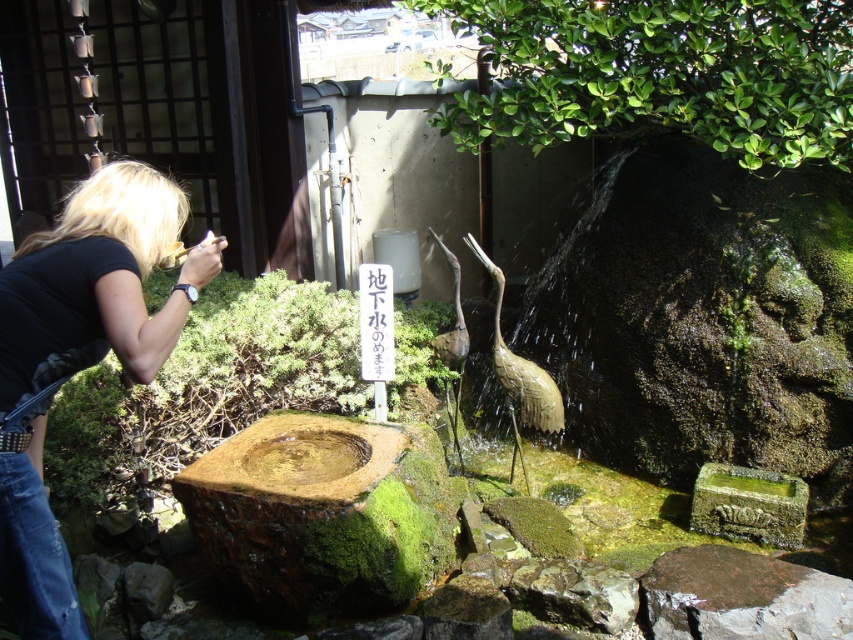
You are a visitor in the garden and want to place a small offering on the black fabric at left without stepping on the green mossy rock at lower right. Is this possible?

The black fabric at left is located above the green mossy rock at lower right, so you can place the offering on the black fabric at left without stepping on the green mossy rock at lower right by reaching upwards from a position near the rock.